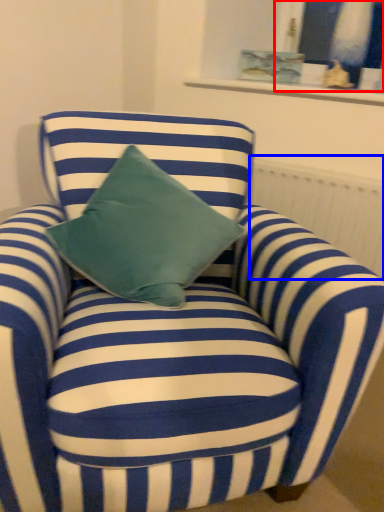
Question: Which of the following is the farthest to the observer, window (highlighted by a red box) or radiator (highlighted by a blue box)?

Choices:
 (A) window
 (B) radiator

Answer: (A)